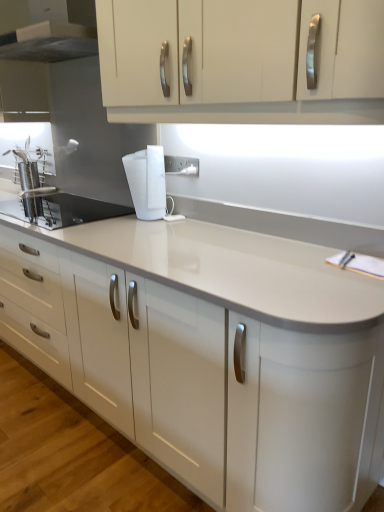
Question: Is brushed metal range hood at upper left wider or thinner than white glossy countertop at center?

Choices:
 (A) wide
 (B) thin

Answer: (B)

Question: In the image, is brushed metal range hood at upper left positioned in front of or behind white glossy countertop at center?

Choices:
 (A) front
 (B) behind

Answer: (B)

Question: Which is farther from the white matte mug at center?

Choices:
 (A) white glossy countertop at center
 (B) brushed metal range hood at upper left
 (C) satin steel sink at left
 (D) white plastic electric outlet at center
 (E) white glossy cabinet at upper center

Answer: (B)

Question: Based on their relative distances, which object is nearer to the white matte mug at center?

Choices:
 (A) satin steel sink at left
 (B) white plastic electric outlet at center
 (C) brushed metal range hood at upper left
 (D) white glossy countertop at center
 (E) white glossy cabinet at upper center

Answer: (B)